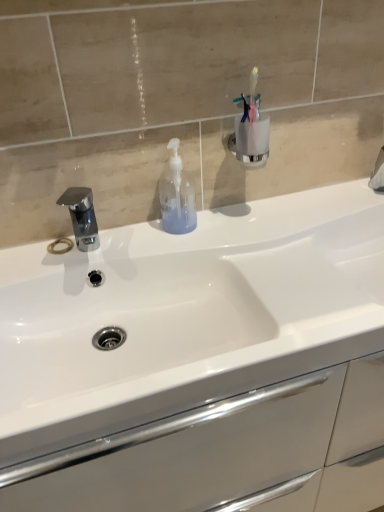
At what (x,y) coordinates should I click in order to perform the action: click on free area in between translucent plastic soap dispenser at center and chrome metallic faucet at left. Please return your answer as a coordinate pair (x, y). The image size is (384, 512). Looking at the image, I should click on (137, 244).